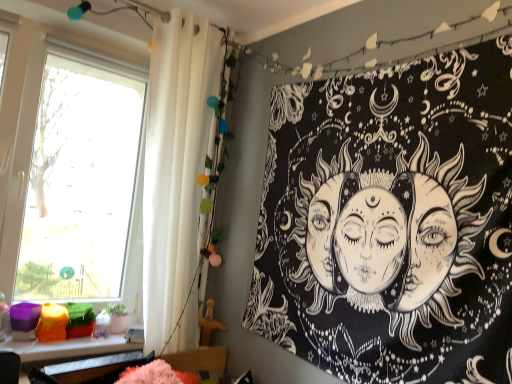
Locate an element on the screen. blank space situated above plastic colorful objects at lower left (from a real-world perspective) is located at coordinates (72, 339).